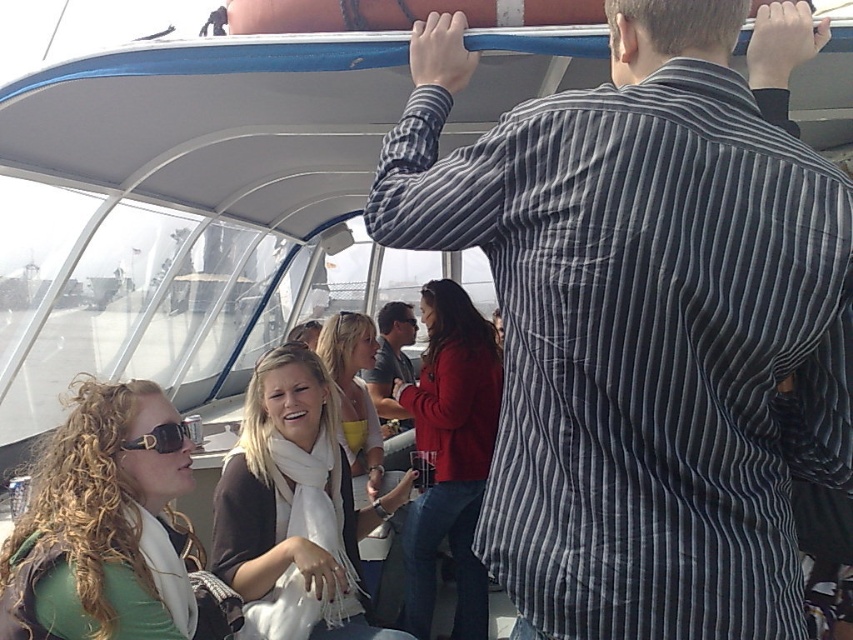
You are a photographer trying to capture a photo of the matte red jacket at center and the matte gray shirt at center. Since you want both subjects to be fully visible in the frame, which one should you position closer to the camera?

The matte red jacket at center is taller than the matte gray shirt at center, so to ensure both are fully visible in the frame, position the matte red jacket at center closer to the camera to avoid it being cropped out.

You are standing at the point marked as point (328, 424) on the boat. You want to take a photo of the camera that is 3.02 meters away. Is the blue rail at the top of the boat canopy in your way?

The point (328, 424) is 3.02 meters away from the camera. However, the blue rail at the top of the boat canopy is being held by a man in a striped shirt, so it might block your view when taking the photo.

You are a photographer on the boat and want to take a photo of the matte red jacket at center and the matte gray shirt at center. Which one is positioned lower in the frame?

The matte red jacket at center is located below the matte gray shirt at center, so it is positioned lower in the frame.